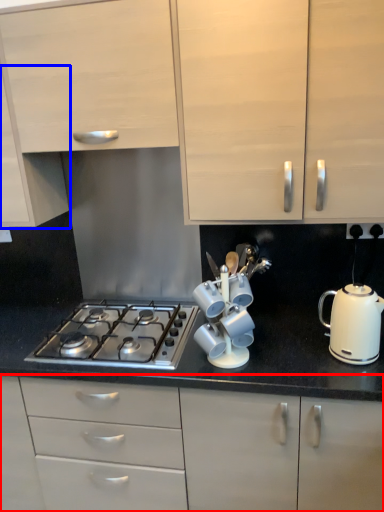
Question: Which object is further to the camera taking this photo, cabinetry (highlighted by a red box) or cabinetry (highlighted by a blue box)?

Choices:
 (A) cabinetry
 (B) cabinetry

Answer: (B)